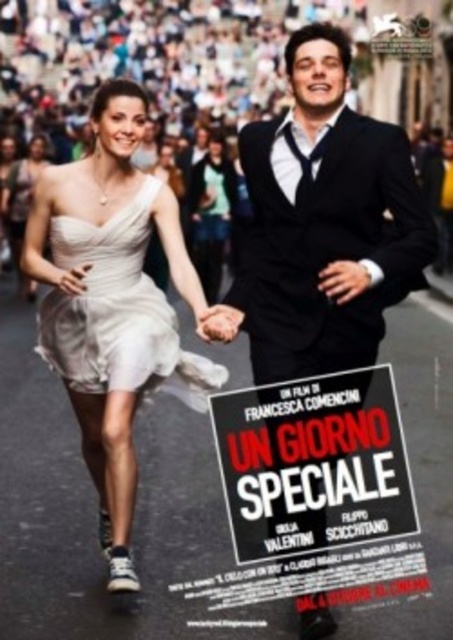
Question: Which object is positioned farthest from the matte white text at center?

Choices:
 (A) smooth skin hand at center
 (B) satin white dress at center
 (C) shiny black suit at center
 (D) white satin dress at center

Answer: (A)

Question: Is white satin dress at center to the right of smooth skin hand at center from the viewer's perspective?

Choices:
 (A) yes
 (B) no

Answer: (B)

Question: Does matte white text at center have a larger size compared to satin white dress at center?

Choices:
 (A) no
 (B) yes

Answer: (A)

Question: Which point appears farthest from the camera in this image?

Choices:
 (A) (155, 182)
 (B) (226, 305)
 (C) (251, 189)
 (D) (404, 467)

Answer: (A)

Question: Is shiny black suit at center thinner than white satin dress at center?

Choices:
 (A) no
 (B) yes

Answer: (A)

Question: Which point is farther to the camera?

Choices:
 (A) white satin dress at center
 (B) smooth skin hand at center

Answer: (B)